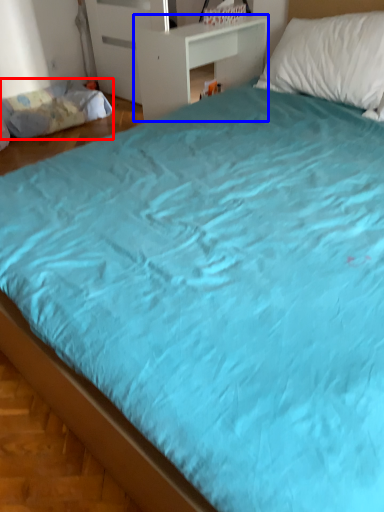
Question: Which point is closer to the camera, mattress (highlighted by a red box) or table (highlighted by a blue box)?

Choices:
 (A) mattress
 (B) table

Answer: (B)